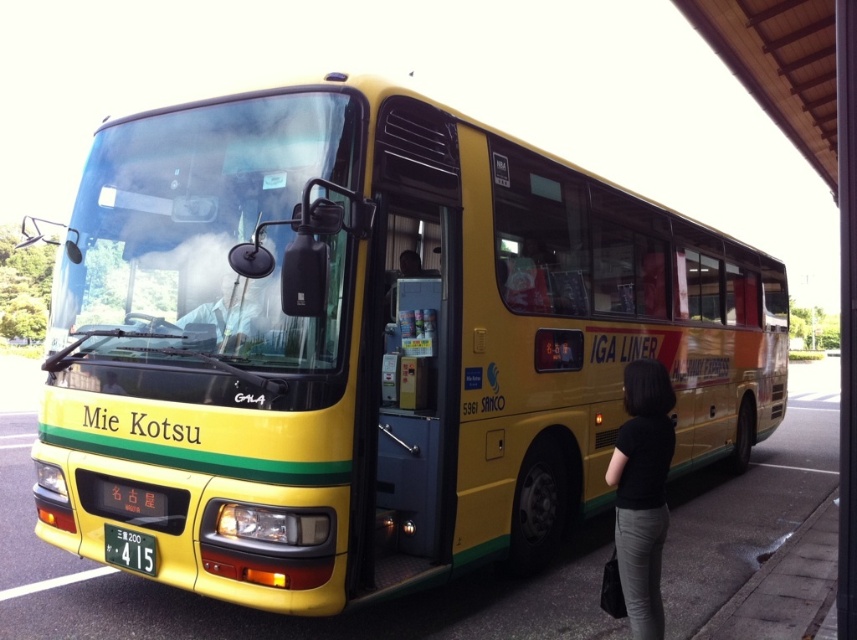
You are standing in front of the bus and want to compare the width of the black fabric at lower right and the yellow plastic license plate at lower center. Which one is wider?

The yellow plastic license plate at lower center is wider than the black fabric at lower right.

You are standing in front of the bus and notice the black fabric at lower right and the yellow plastic license plate at lower center. Which object is nearer to you?

The black fabric at lower right is closer to the viewer than the yellow plastic license plate at lower center.

You are a delivery person who needs to attach a package to the side of the bus. The package requires a secure spot that is at least 10 feet away from the yellow plastic license plate at lower center to avoid blocking important information. Is the black fabric at lower right a suitable location?

The black fabric at lower right is 9.20 feet from the yellow plastic license plate at lower center. Since the required distance is at least 10 feet, the black fabric at lower right is not a suitable location because it is too close.